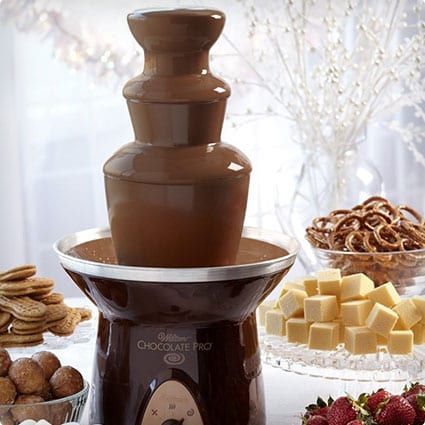
The width and height of the screenshot is (425, 425). What are the coordinates of `chocolate fountain machine` in the screenshot? It's located at (214, 204).